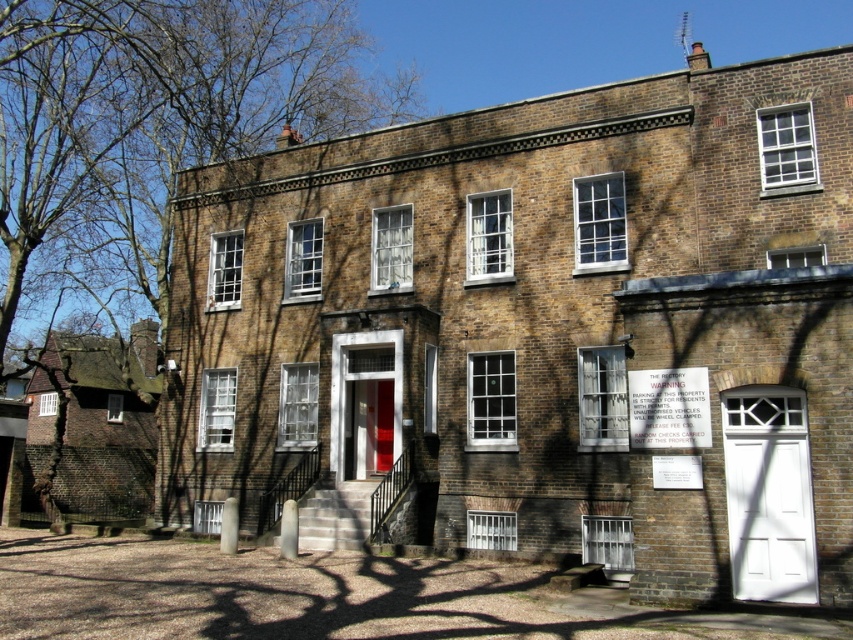
Question: Can you confirm if white matte door at lower right is bigger than matte red door at center?

Choices:
 (A) no
 (B) yes

Answer: (B)

Question: Is bare branches at left below matte red door at center?

Choices:
 (A) yes
 (B) no

Answer: (B)

Question: Which object is farther from the camera taking this photo?

Choices:
 (A) bare branches at left
 (B) matte red door at center
 (C) white matte door at lower right

Answer: (B)

Question: Which point is closer to the camera?

Choices:
 (A) bare branches at left
 (B) white matte door at lower right
 (C) matte red door at center

Answer: (B)

Question: Does bare branches at left have a smaller size compared to matte red door at center?

Choices:
 (A) yes
 (B) no

Answer: (B)

Question: Which point is closer to the camera?

Choices:
 (A) (347, 472)
 (B) (737, 500)
 (C) (10, 362)

Answer: (B)